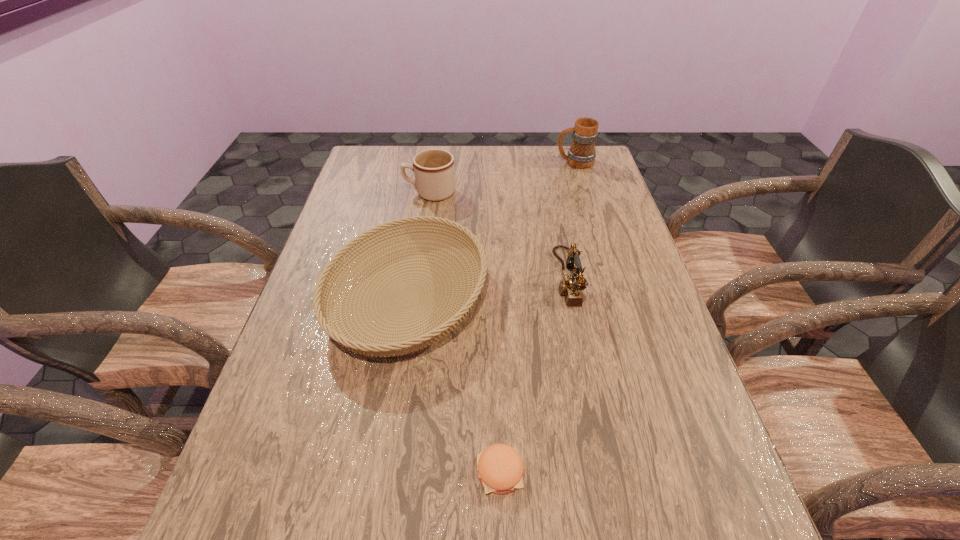
Where is `object at the left edge`? object at the left edge is located at coordinates (463, 303).

This screenshot has height=540, width=960. I want to click on object that is at the right edge, so click(x=581, y=154).

The image size is (960, 540). In order to click on object positioned at the far right corner in this screenshot , I will do `click(581, 154)`.

Identify the location of free region at the far edge of the desktop. The image size is (960, 540). (468, 179).

You are a GUI agent. You are given a task and a screenshot of the screen. Output one action in this format:
    pyautogui.click(x=<x>, y=<y>)
    Task: Click on the free spot at the left edge of the desktop
    This screenshot has width=960, height=540.
    Given the screenshot: What is the action you would take?
    pyautogui.click(x=307, y=322)

You are a GUI agent. You are given a task and a screenshot of the screen. Output one action in this format:
    pyautogui.click(x=<x>, y=<y>)
    Task: Click on the free region at the right edge
    
    Given the screenshot: What is the action you would take?
    pyautogui.click(x=660, y=474)

At what (x,y) coordinates should I click in order to perform the action: click on vacant area at the far left corner of the desktop. Please return your answer as a coordinate pair (x, y). The image size is (960, 540). Looking at the image, I should click on (362, 164).

At what (x,y) coordinates should I click in order to perform the action: click on blank region between the nearer mug and the shortest object. Please return your answer as a coordinate pair (x, y). Image resolution: width=960 pixels, height=540 pixels. Looking at the image, I should click on (465, 333).

This screenshot has width=960, height=540. I want to click on empty space between the nearest object and the farthest object, so [538, 317].

Image resolution: width=960 pixels, height=540 pixels. I want to click on free space that is in between the rightmost object and the second farthest object, so tap(502, 178).